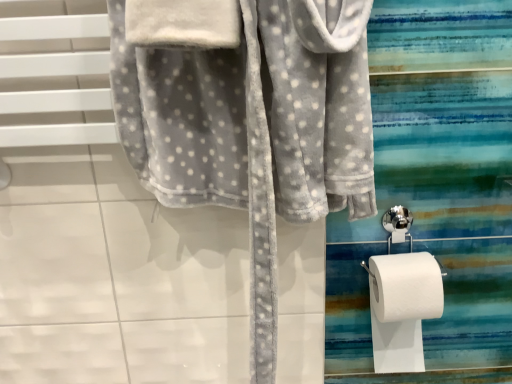
Where is `soft gray fleece robe at center`? This screenshot has width=512, height=384. soft gray fleece robe at center is located at coordinates (253, 126).

The image size is (512, 384). What do you see at coordinates (253, 126) in the screenshot? I see `soft gray fleece robe at center` at bounding box center [253, 126].

What is the approximate height of soft gray fleece robe at center?

soft gray fleece robe at center is 23.81 inches tall.

Locate an element on the screen. This screenshot has width=512, height=384. white paper at right is located at coordinates pyautogui.click(x=402, y=308).

Describe the element at coordinates (402, 308) in the screenshot. The width and height of the screenshot is (512, 384). I see `white paper at right` at that location.

Find the location of `soft gray fleece robe at center`. soft gray fleece robe at center is located at coordinates (253, 126).

Is white paper at right at the right side of soft gray fleece robe at center?

Yes, white paper at right is to the right of soft gray fleece robe at center.

In the scene shown: Considering the relative positions of white paper at right and soft gray fleece robe at center in the image provided, is white paper at right behind soft gray fleece robe at center?

Yes, it is.

Which is less distant, (401, 318) or (321, 3)?

The point (321, 3) is closer to the camera.

From the image's perspective, would you say white paper at right is positioned over soft gray fleece robe at center?

Actually, white paper at right appears below soft gray fleece robe at center in the image.

Looking at this image, from a real-world perspective, is white paper at right positioned above or below soft gray fleece robe at center?

white paper at right is below soft gray fleece robe at center.

Considering the sizes of white paper at right and soft gray fleece robe at center in the image, is white paper at right wider or thinner than soft gray fleece robe at center?

white paper at right is wider than soft gray fleece robe at center.

Considering the sizes of objects white paper at right and soft gray fleece robe at center in the image provided, who is shorter, white paper at right or soft gray fleece robe at center?

Standing shorter between the two is white paper at right.

Considering the relative sizes of white paper at right and soft gray fleece robe at center in the image provided, is white paper at right bigger than soft gray fleece robe at center?

No, white paper at right is not bigger than soft gray fleece robe at center.

Is white paper at right spatially inside soft gray fleece robe at center, or outside of it?

white paper at right is spatially situated outside soft gray fleece robe at center.

Is white paper at right directly adjacent to soft gray fleece robe at center?

white paper at right is not next to soft gray fleece robe at center, and they're not touching.

Is white paper at right looking in the opposite direction of soft gray fleece robe at center?

white paper at right does not have its back to soft gray fleece robe at center.

At what (x,y) coordinates should I click in order to perform the action: click on toilet paper on the right of soft gray fleece robe at center. Please return your answer as a coordinate pair (x, y). The height and width of the screenshot is (384, 512). Looking at the image, I should click on (402, 308).

Does soft gray fleece robe at center appear on the left side of white paper at right?

Yes.

Is the position of soft gray fleece robe at center more distant than that of white paper at right?

No.

Considering the points (250, 157) and (400, 312), which point is in front, point (250, 157) or point (400, 312)?

Point (250, 157)

From the image's perspective, which one is positioned lower, soft gray fleece robe at center or white paper at right?

white paper at right appears lower in the image.

From a real-world perspective, is soft gray fleece robe at center below white paper at right?

No.

Is soft gray fleece robe at center wider than white paper at right?

No.

Which of these two, soft gray fleece robe at center or white paper at right, stands shorter?

Standing shorter between the two is white paper at right.

Considering the relative sizes of soft gray fleece robe at center and white paper at right in the image provided, is soft gray fleece robe at center bigger than white paper at right?

Yes.

Could white paper at right be considered to be inside soft gray fleece robe at center?

That's incorrect, white paper at right is not inside soft gray fleece robe at center.

In the scene shown: Is soft gray fleece robe at center placed right next to white paper at right?

They are not placed beside each other.

Could you tell me if soft gray fleece robe at center is facing white paper at right?

No, soft gray fleece robe at center is not aimed at white paper at right.

Measure the distance between soft gray fleece robe at center and white paper at right.

They are 12.30 inches apart.

The image size is (512, 384). What are the coordinates of `towel that is above the white paper at right (from a real-world perspective)` in the screenshot? It's located at (253, 126).

Image resolution: width=512 pixels, height=384 pixels. What are the coordinates of `towel in front of the white paper at right` in the screenshot? It's located at (253, 126).

This screenshot has width=512, height=384. Find the location of `toilet paper below the soft gray fleece robe at center (from the image's perspective)`. toilet paper below the soft gray fleece robe at center (from the image's perspective) is located at coordinates (402, 308).